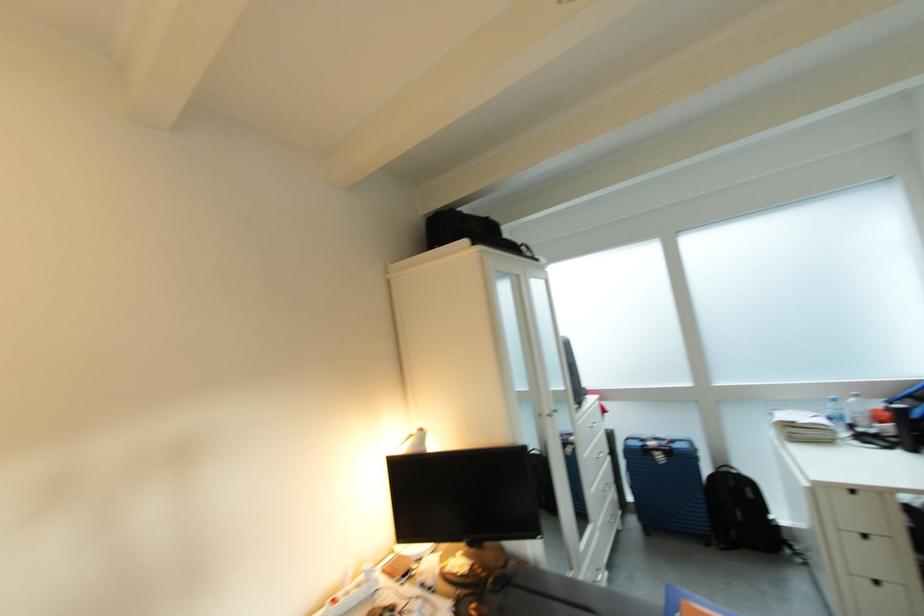
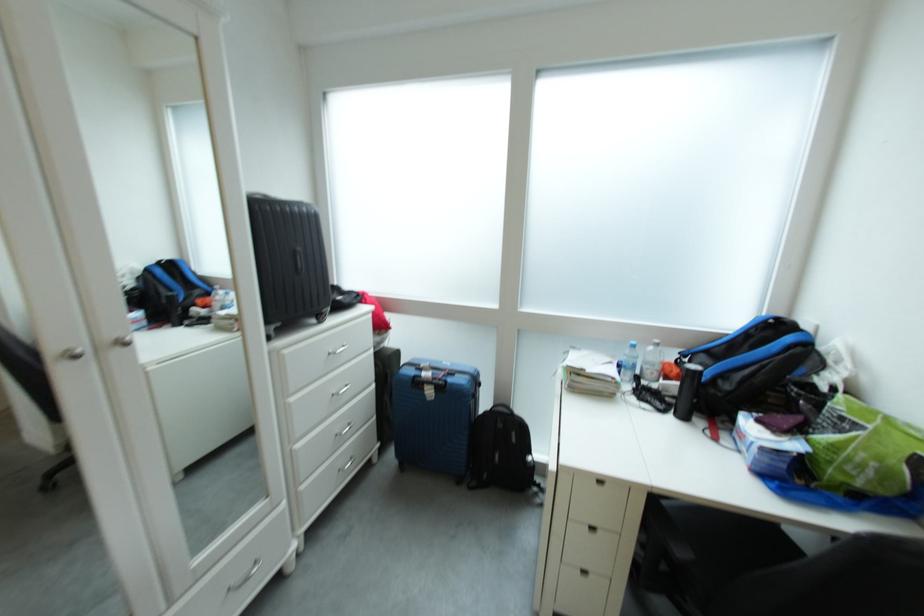
Find the pixel in the second image that matches the point at 861,426 in the first image.

(650, 376)